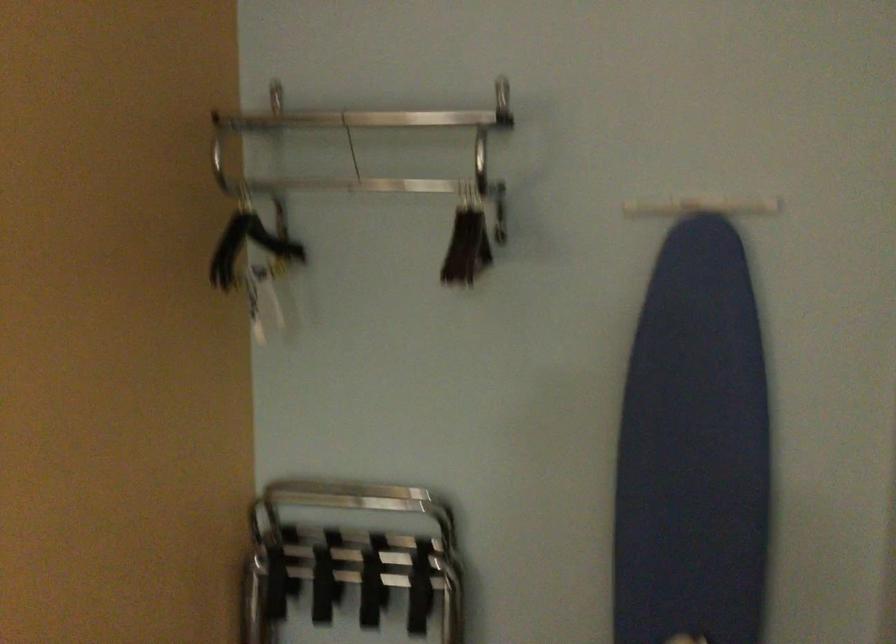
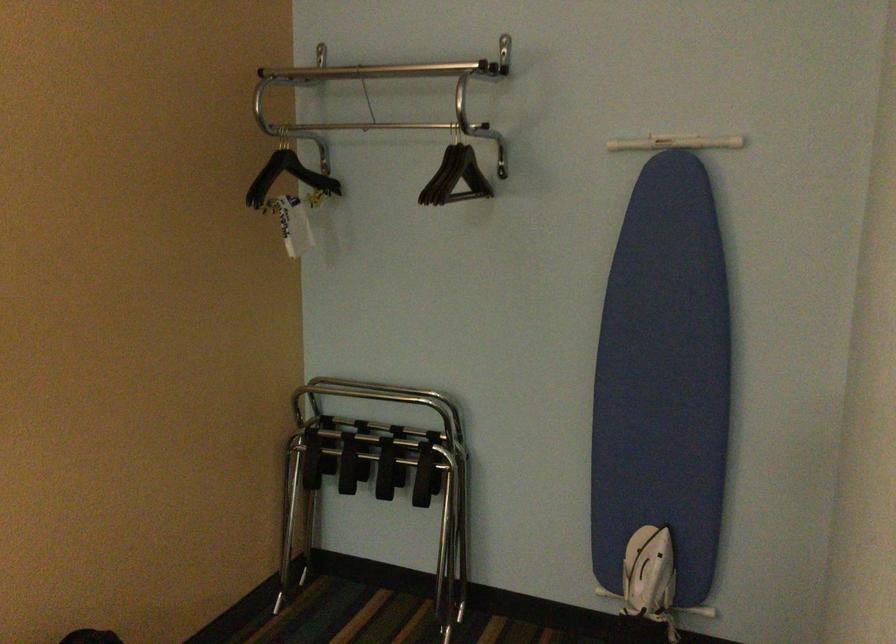
The point at (471, 245) is marked in the first image. Where is the corresponding point in the second image?

(455, 176)